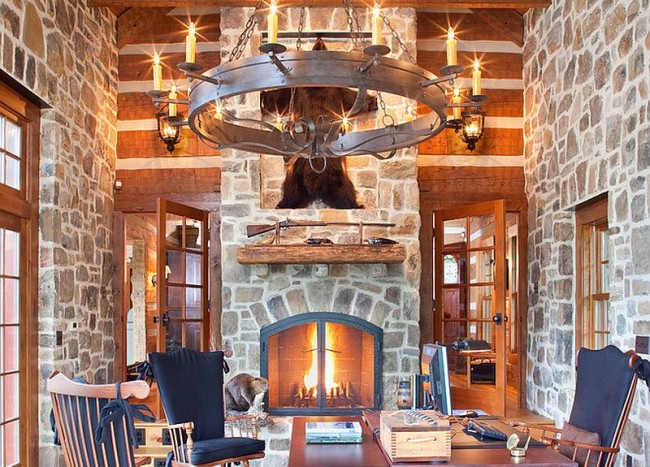
Locate an element on the screen. books on table is located at coordinates (344, 435).